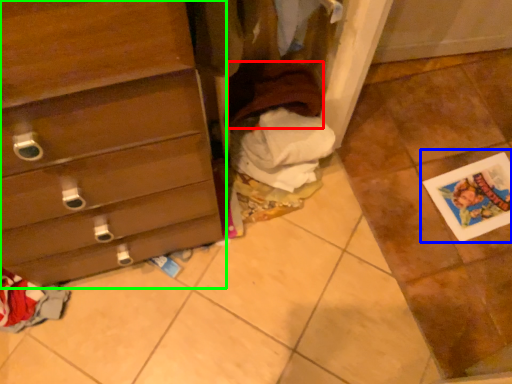
Question: Based on their relative distances, which object is farther from clothing (highlighted by a red box)? Choose from postcard (highlighted by a blue box) and chest of drawers (highlighted by a green box).

Choices:
 (A) postcard
 (B) chest of drawers

Answer: (A)